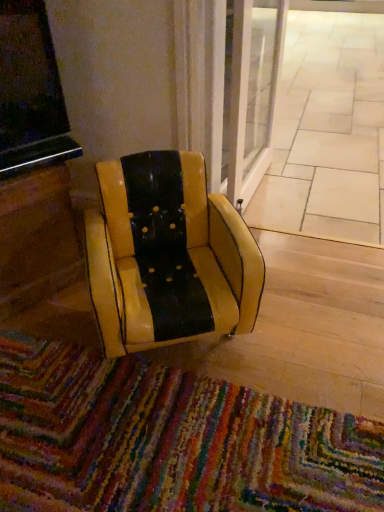
Question: Is multicolored woven mat at lower center to the left of beige tile pavement at center from the viewer's perspective?

Choices:
 (A) no
 (B) yes

Answer: (B)

Question: Is multicolored woven mat at lower center positioned before beige tile pavement at center?

Choices:
 (A) yes
 (B) no

Answer: (A)

Question: From a real-world perspective, does multicolored woven mat at lower center sit lower than beige tile pavement at center?

Choices:
 (A) no
 (B) yes

Answer: (A)

Question: Considering the relative sizes of multicolored woven mat at lower center and beige tile pavement at center in the image provided, is multicolored woven mat at lower center thinner than beige tile pavement at center?

Choices:
 (A) yes
 (B) no

Answer: (A)

Question: Is multicolored woven mat at lower center wider than beige tile pavement at center?

Choices:
 (A) yes
 (B) no

Answer: (B)

Question: Is beige tile pavement at center spatially inside yellow leather chair at center, or outside of it?

Choices:
 (A) inside
 (B) outside

Answer: (B)

Question: Considering their positions, is beige tile pavement at center located in front of or behind yellow leather chair at center?

Choices:
 (A) behind
 (B) front

Answer: (A)

Question: From a real-world perspective, is beige tile pavement at center above or below yellow leather chair at center?

Choices:
 (A) below
 (B) above

Answer: (A)

Question: Considering the positions of beige tile pavement at center and yellow leather chair at center in the image, is beige tile pavement at center wider or thinner than yellow leather chair at center?

Choices:
 (A) wide
 (B) thin

Answer: (A)

Question: Considering the relative positions of multicolored woven mat at lower center and beige tile pavement at center in the image provided, is multicolored woven mat at lower center to the left or to the right of beige tile pavement at center?

Choices:
 (A) left
 (B) right

Answer: (A)

Question: Would you say multicolored woven mat at lower center is inside or outside beige tile pavement at center?

Choices:
 (A) inside
 (B) outside

Answer: (B)

Question: In terms of width, does multicolored woven mat at lower center look wider or thinner when compared to beige tile pavement at center?

Choices:
 (A) wide
 (B) thin

Answer: (B)

Question: Is multicolored woven mat at lower center bigger or smaller than beige tile pavement at center?

Choices:
 (A) big
 (B) small

Answer: (B)

Question: Considering the positions of multicolored woven mat at lower center and yellow leather chair at center in the image, is multicolored woven mat at lower center wider or thinner than yellow leather chair at center?

Choices:
 (A) wide
 (B) thin

Answer: (A)

Question: From a real-world perspective, is multicolored woven mat at lower center physically located above or below yellow leather chair at center?

Choices:
 (A) above
 (B) below

Answer: (B)